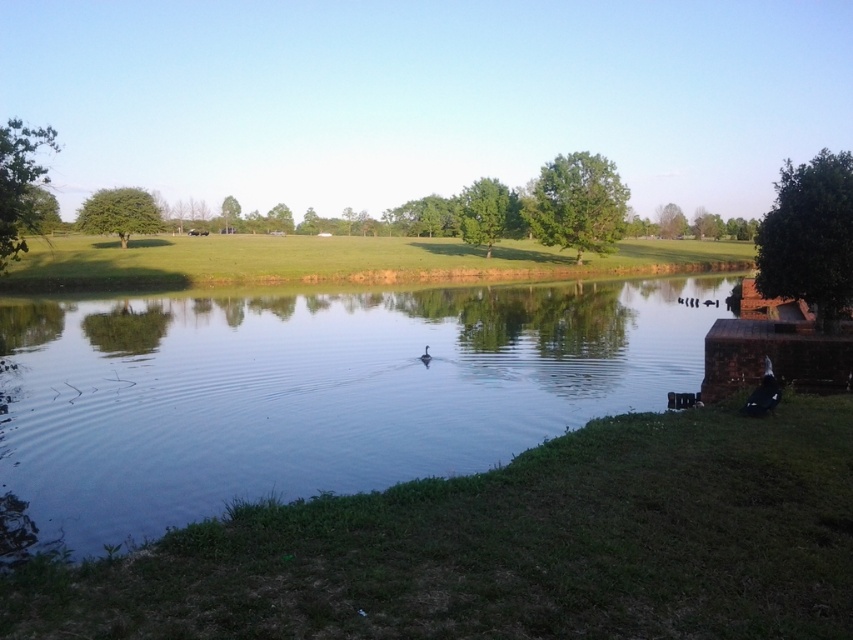
You are a photographer aiming to capture the black matte duck at center in the reflection of the clear water at center. Is the duck visible in the water?

The clear water at center is above the black matte duck at center, so the duck is above the water and its reflection would be visible in the water below.

Consider the image. You are planning to set up a small picnic area in the green grassy field at center. Considering the size of the black matte duck at center, will there be enough space for a picnic blanket and a few chairs?

The green grassy field at center is larger in size than the black matte duck at center, so there should be sufficient space for a picnic blanket and a few chairs.